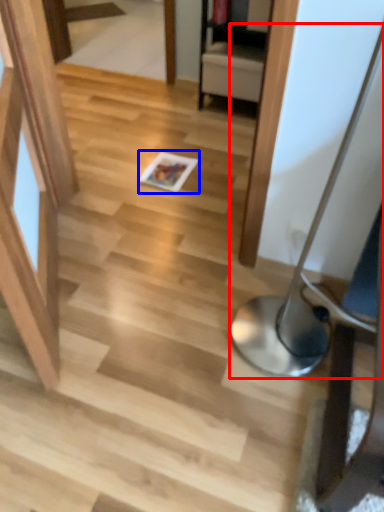
Question: Which point is further to the camera, table lamp (highlighted by a red box) or magazine (highlighted by a blue box)?

Choices:
 (A) table lamp
 (B) magazine

Answer: (B)